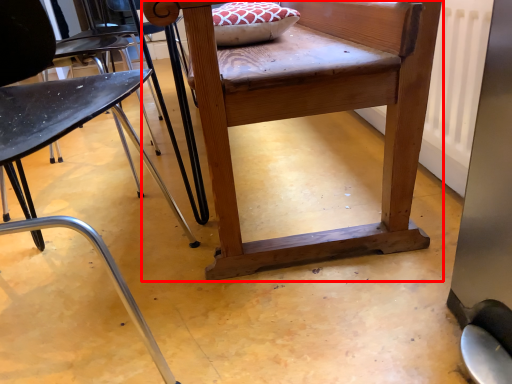
Question: From the image's perspective, considering the relative positions of table (annotated by the red box) and chair in the image provided, where is table (annotated by the red box) located with respect to the staircase?

Choices:
 (A) below
 (B) above

Answer: (B)